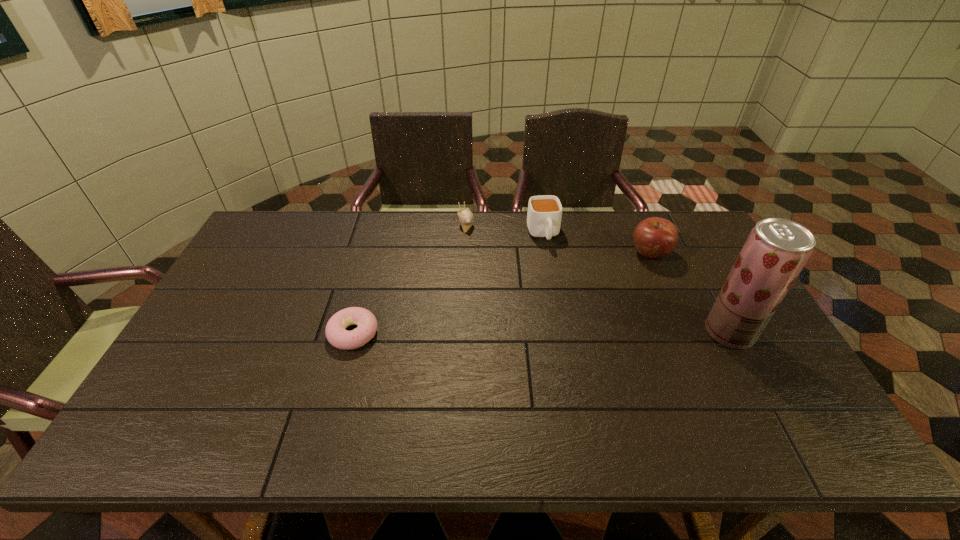
At what (x,y) coordinates should I click in order to perform the action: click on escargot situated at the far edge. Please return your answer as a coordinate pair (x, y). This screenshot has width=960, height=540. Looking at the image, I should click on (466, 217).

At what (x,y) coordinates should I click in order to perform the action: click on fruit juice located in the right edge section of the desktop. Please return your answer as a coordinate pair (x, y). The image size is (960, 540). Looking at the image, I should click on (776, 250).

Identify the location of apple that is at the right edge. The height and width of the screenshot is (540, 960). (654, 237).

Where is `object present at the far right corner`? The height and width of the screenshot is (540, 960). object present at the far right corner is located at coordinates (654, 237).

Where is `vacant area at the far edge of the desktop`? This screenshot has height=540, width=960. vacant area at the far edge of the desktop is located at coordinates (396, 231).

Where is `free space at the near edge`? free space at the near edge is located at coordinates (734, 393).

You are a GUI agent. You are given a task and a screenshot of the screen. Output one action in this format:
    pyautogui.click(x=<x>, y=<y>)
    Task: Click on the blank space at the left edge
    The width and height of the screenshot is (960, 540).
    Given the screenshot: What is the action you would take?
    pyautogui.click(x=196, y=345)

Where is `vacant space at the right edge of the desktop`? vacant space at the right edge of the desktop is located at coordinates (731, 359).

Locate an element on the screen. The height and width of the screenshot is (540, 960). free space at the far right corner is located at coordinates (688, 238).

The height and width of the screenshot is (540, 960). Identify the location of vacant area that lies between the fourth tallest object and the third object from left to right. (504, 228).